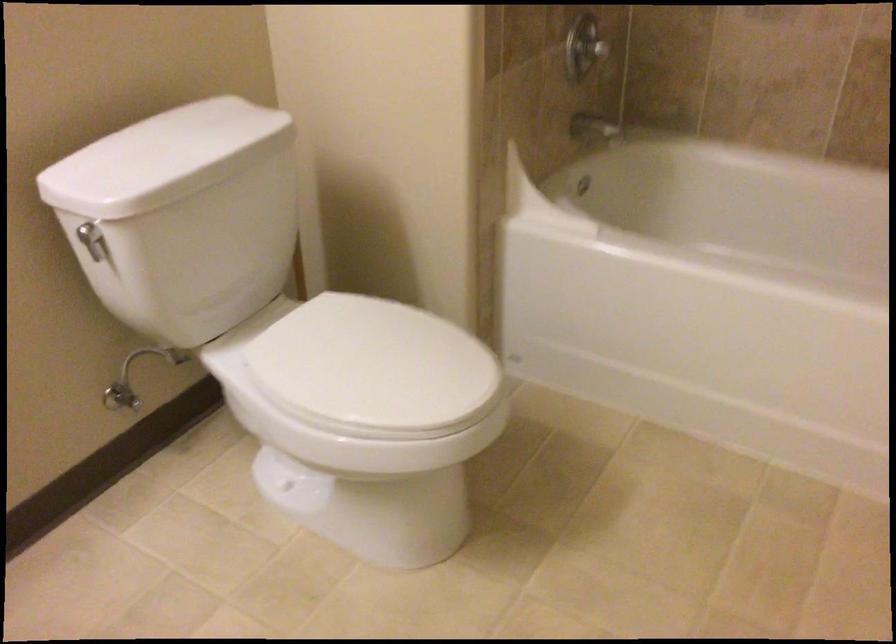
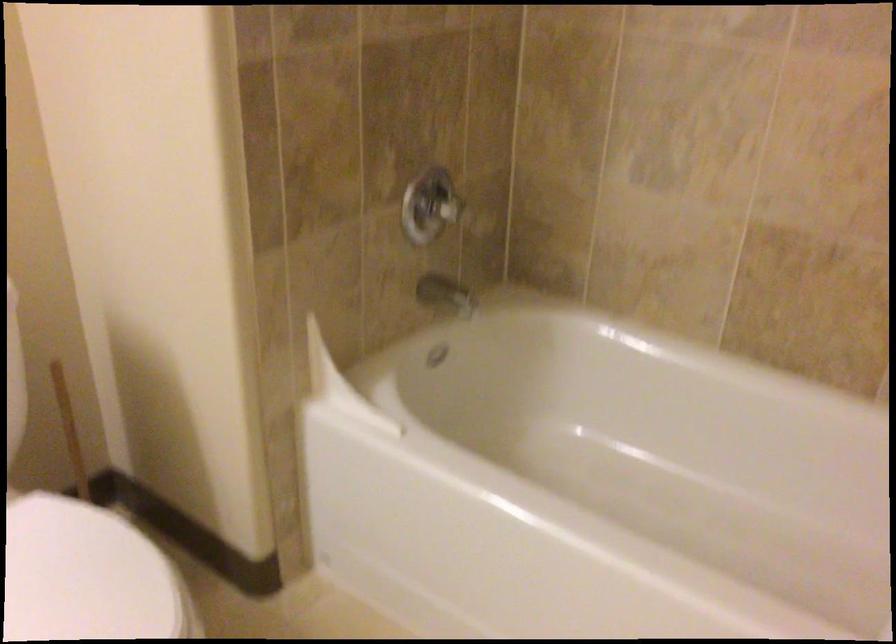
In the second image, find the point that corresponds to the point at 395,337 in the first image.

(88, 576)